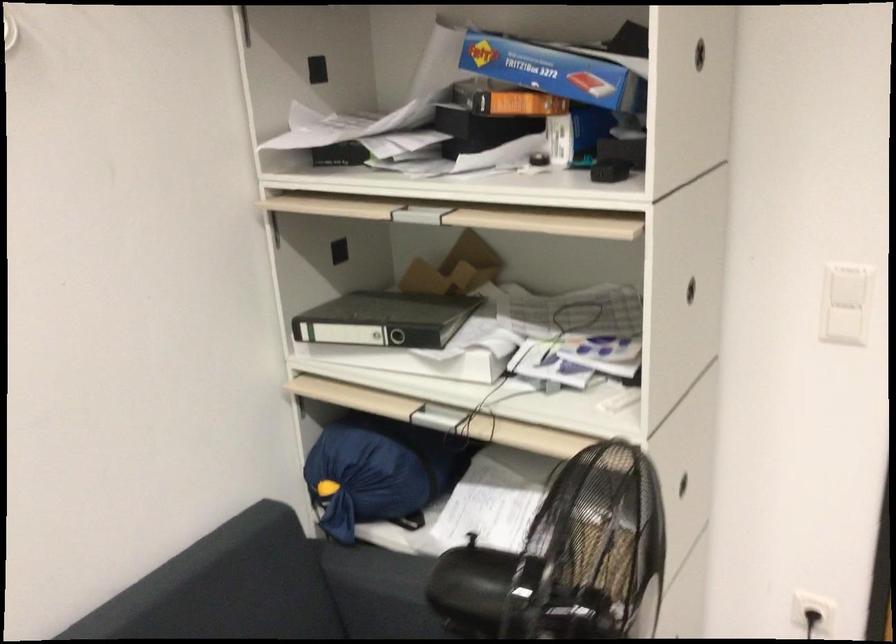
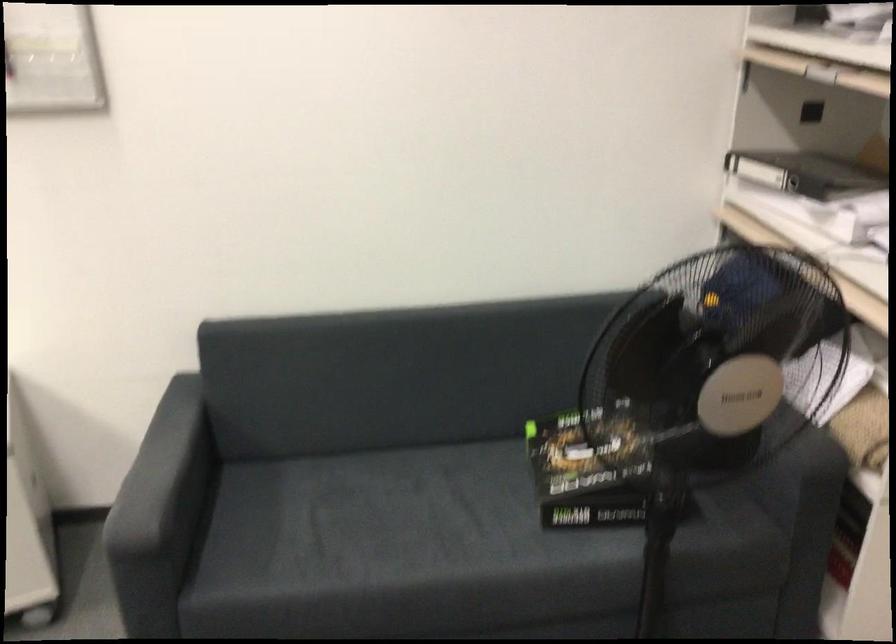
Question: The camera is either moving clockwise (left) or counter-clockwise (right) around the object. The first image is from the beginning of the video and the second image is from the end. Is the camera moving left or right when shooting the video?

Choices:
 (A) Left
 (B) Right

Answer: (B)